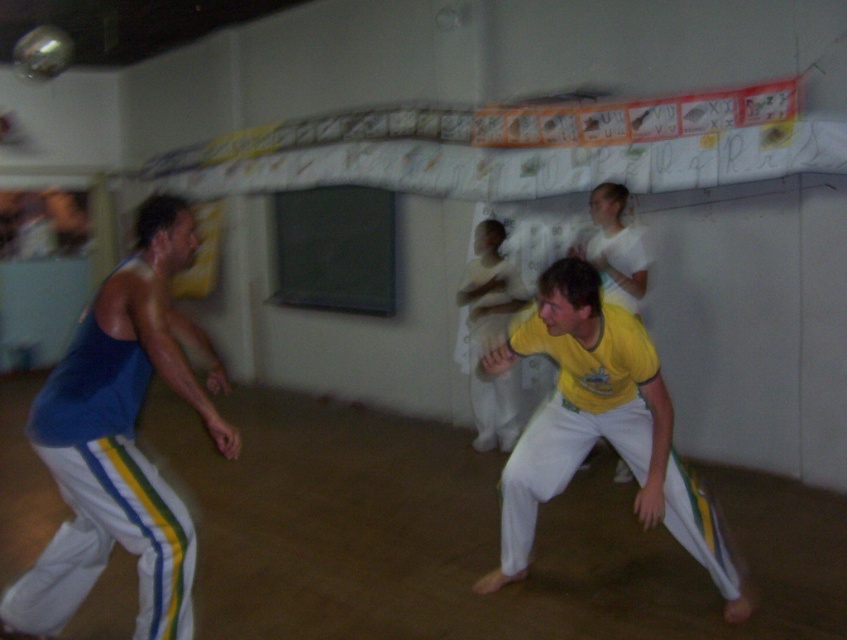
Who is taller, blue fabric pants at left or yellow matte/yellowish-green material pants at center?

blue fabric pants at left is taller.

The width and height of the screenshot is (847, 640). Describe the element at coordinates (120, 442) in the screenshot. I see `blue fabric pants at left` at that location.

Find the location of `blue fabric pants at left`. blue fabric pants at left is located at coordinates (120, 442).